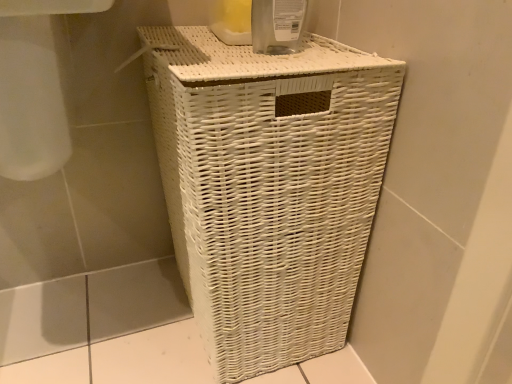
Question: Based on their positions, is white wicker basket at center located to the left or right of transparent plastic bottle at upper center?

Choices:
 (A) left
 (B) right

Answer: (A)

Question: Is white wicker basket at center situated inside transparent plastic bottle at upper center or outside?

Choices:
 (A) inside
 (B) outside

Answer: (B)

Question: From a real-world perspective, is white wicker basket at center positioned above or below transparent plastic bottle at upper center?

Choices:
 (A) below
 (B) above

Answer: (A)

Question: From the image's perspective, is transparent plastic bottle at upper center positioned above or below white wicker basket at center?

Choices:
 (A) below
 (B) above

Answer: (B)

Question: From their relative heights in the image, would you say transparent plastic bottle at upper center is taller or shorter than white wicker basket at center?

Choices:
 (A) tall
 (B) short

Answer: (B)

Question: Would you say transparent plastic bottle at upper center is to the left or to the right of white wicker basket at center in the picture?

Choices:
 (A) left
 (B) right

Answer: (B)

Question: Does point pos(296,14) appear closer or farther from the camera than point pos(360,67)?

Choices:
 (A) closer
 (B) farther

Answer: (B)